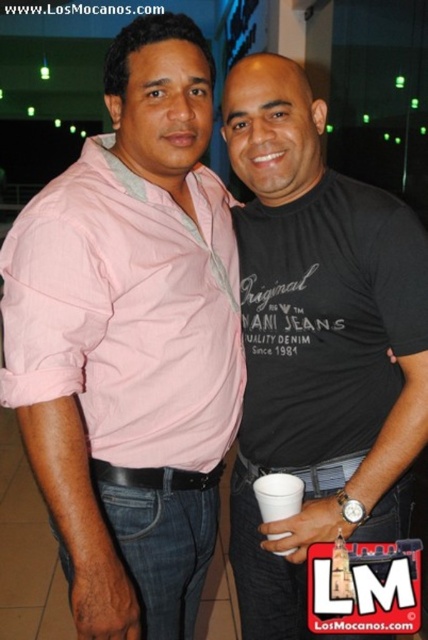
Which is below, black cotton t-shirt at center or white paper cup at center?

white paper cup at center is below.

Is black cotton t-shirt at center thinner than white paper cup at center?

In fact, black cotton t-shirt at center might be wider than white paper cup at center.

Between point (297, 579) and point (302, 499), which one is positioned behind?

Point (297, 579)

The width and height of the screenshot is (428, 640). Identify the location of black cotton t-shirt at center. (318, 344).

Can you confirm if pink cotton shirt at center is positioned above white paper cup at center?

Correct, pink cotton shirt at center is located above white paper cup at center.

The image size is (428, 640). What do you see at coordinates (130, 337) in the screenshot? I see `pink cotton shirt at center` at bounding box center [130, 337].

This screenshot has width=428, height=640. Describe the element at coordinates (130, 337) in the screenshot. I see `pink cotton shirt at center` at that location.

Where is `pink cotton shirt at center`? pink cotton shirt at center is located at coordinates (130, 337).

Is pink cotton shirt at center wider than black leather belt at center?

Yes, pink cotton shirt at center is wider than black leather belt at center.

Between pink cotton shirt at center and black leather belt at center, which one is positioned higher?

pink cotton shirt at center is higher up.

Is point (199, 44) positioned in front of point (219, 480)?

Yes, it is.

In order to click on pink cotton shirt at center in this screenshot , I will do `click(130, 337)`.